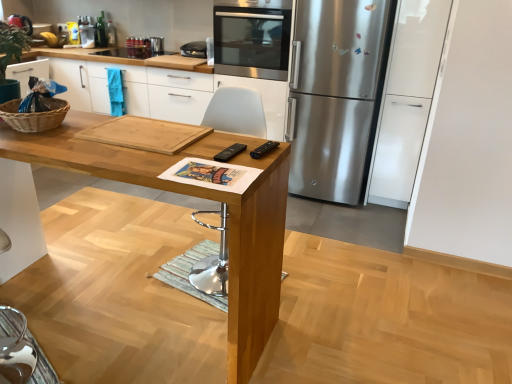
Locate an element on the screen. The width and height of the screenshot is (512, 384). empty space that is ontop of natural wood table at center (from a real-world perspective) is located at coordinates (154, 138).